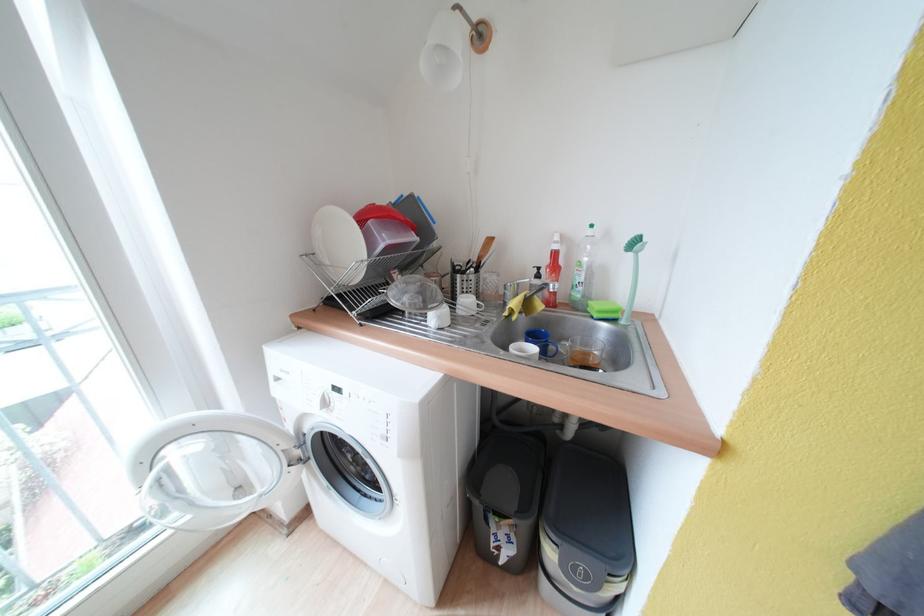
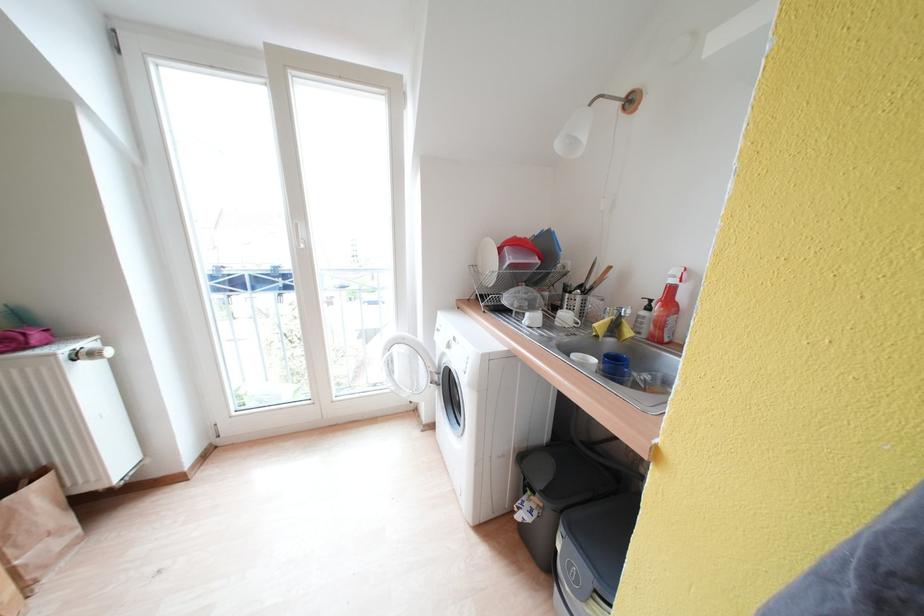
The point at (183, 498) is marked in the first image. Where is the corresponding point in the second image?

(397, 376)